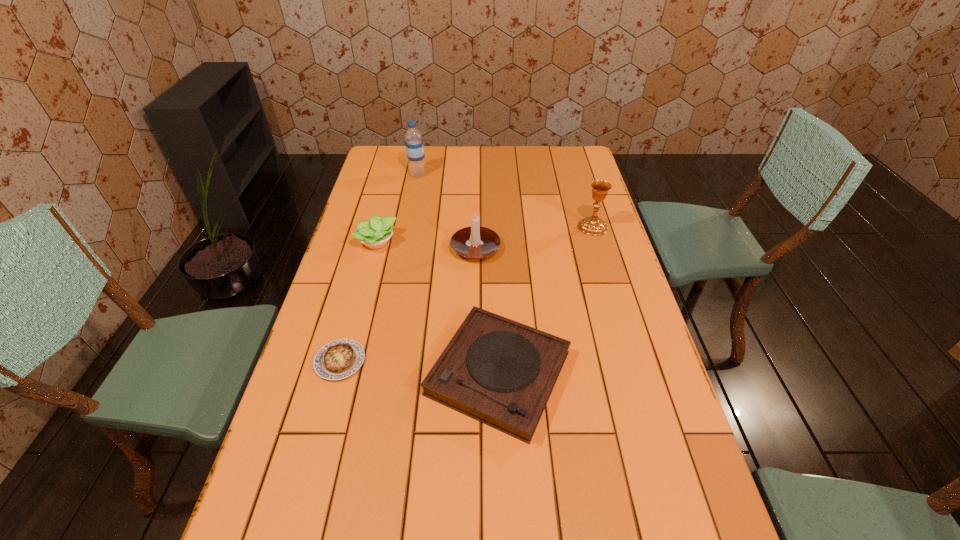
Identify the location of empty space that is in between the quiche and the phonograph record. The width and height of the screenshot is (960, 540). (420, 367).

This screenshot has width=960, height=540. In order to click on unoccupied position between the phonograph record and the rightmost object in this screenshot , I will do `click(545, 300)`.

The width and height of the screenshot is (960, 540). In order to click on object that is the fifth closest to the shortest object in this screenshot , I will do `click(413, 138)`.

Locate an element on the screen. This screenshot has width=960, height=540. object that ranks as the second closest to the shortest object is located at coordinates (374, 234).

Identify the location of free space that satisfies the following two spatial constraints: 1. on the label of the farthest object; 2. on the back side of the fifth tallest object. (379, 373).

Where is `free space that satisfies the following two spatial constraints: 1. on the label of the chalice; 2. on the left side of the farthest object`? The width and height of the screenshot is (960, 540). free space that satisfies the following two spatial constraints: 1. on the label of the chalice; 2. on the left side of the farthest object is located at coordinates (408, 227).

In order to click on blank area in the image that satisfies the following two spatial constraints: 1. on the label of the water bottle; 2. on the left side of the candle in this screenshot , I will do `click(403, 249)`.

Where is `free space in the image that satisfies the following two spatial constraints: 1. on the back side of the chalice; 2. on the right side of the third shortest object`? This screenshot has width=960, height=540. free space in the image that satisfies the following two spatial constraints: 1. on the back side of the chalice; 2. on the right side of the third shortest object is located at coordinates (381, 227).